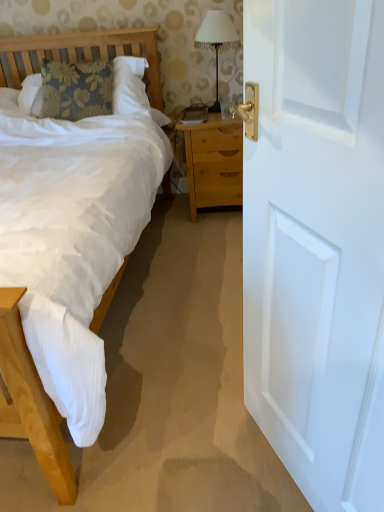
Question: Does white fabric lampshade at upper center come behind white painted wood door at right?

Choices:
 (A) yes
 (B) no

Answer: (A)

Question: Is white fabric lampshade at upper center at the right side of white painted wood door at right?

Choices:
 (A) no
 (B) yes

Answer: (A)

Question: Considering the relative positions of white fabric lampshade at upper center and white painted wood door at right in the image provided, is white fabric lampshade at upper center in front of white painted wood door at right?

Choices:
 (A) yes
 (B) no

Answer: (B)

Question: From the image's perspective, does white fabric lampshade at upper center appear higher than white painted wood door at right?

Choices:
 (A) yes
 (B) no

Answer: (A)

Question: Can you confirm if white fabric lampshade at upper center is bigger than white painted wood door at right?

Choices:
 (A) yes
 (B) no

Answer: (B)

Question: From a real-world perspective, relative to light brown wooden nightstand at center, is white fabric lampshade at upper center vertically above or below?

Choices:
 (A) above
 (B) below

Answer: (A)

Question: Does point (213, 103) appear closer or farther from the camera than point (216, 132)?

Choices:
 (A) closer
 (B) farther

Answer: (B)

Question: In terms of height, does white fabric lampshade at upper center look taller or shorter compared to light brown wooden nightstand at center?

Choices:
 (A) short
 (B) tall

Answer: (A)

Question: From the image's perspective, is white fabric lampshade at upper center positioned above or below light brown wooden nightstand at center?

Choices:
 (A) above
 (B) below

Answer: (A)

Question: Is white painted wood door at right bigger or smaller than white fabric lampshade at upper center?

Choices:
 (A) big
 (B) small

Answer: (A)

Question: Is white painted wood door at right taller or shorter than white fabric lampshade at upper center?

Choices:
 (A) short
 (B) tall

Answer: (B)

Question: From the image's perspective, is white painted wood door at right positioned above or below white fabric lampshade at upper center?

Choices:
 (A) below
 (B) above

Answer: (A)

Question: Is white painted wood door at right wider or thinner than white fabric lampshade at upper center?

Choices:
 (A) wide
 (B) thin

Answer: (B)

Question: Is point (221, 122) positioned closer to the camera than point (249, 366)?

Choices:
 (A) closer
 (B) farther

Answer: (B)

Question: From the image's perspective, is light brown wooden nightstand at center positioned above or below white painted wood door at right?

Choices:
 (A) above
 (B) below

Answer: (A)